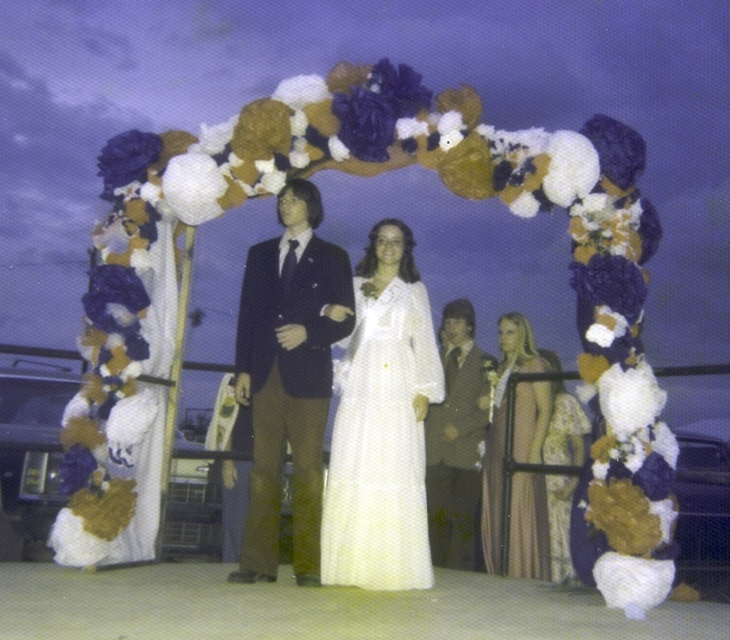
Question: Based on their relative distances, which object is nearer to the silky gold dress at center?

Choices:
 (A) white dotted fabric dress at center
 (B) silky beige dress at right
 (C) brown wool suit at center

Answer: (B)

Question: Does white satin dress at center appear over shiny dark blue suit at center?

Choices:
 (A) no
 (B) yes

Answer: (A)

Question: Among these points, which one is nearest to the camera?

Choices:
 (A) (580, 428)
 (B) (345, 289)
 (C) (372, 564)

Answer: (C)

Question: Can you confirm if white dotted fabric dress at center is positioned below brown wool suit at center?

Choices:
 (A) yes
 (B) no

Answer: (B)

Question: Which point is closer to the camera?

Choices:
 (A) white satin dress at center
 (B) shiny dark blue suit at center

Answer: (A)

Question: Can you confirm if shiny dark blue suit at center is wider than silky beige dress at right?

Choices:
 (A) yes
 (B) no

Answer: (A)